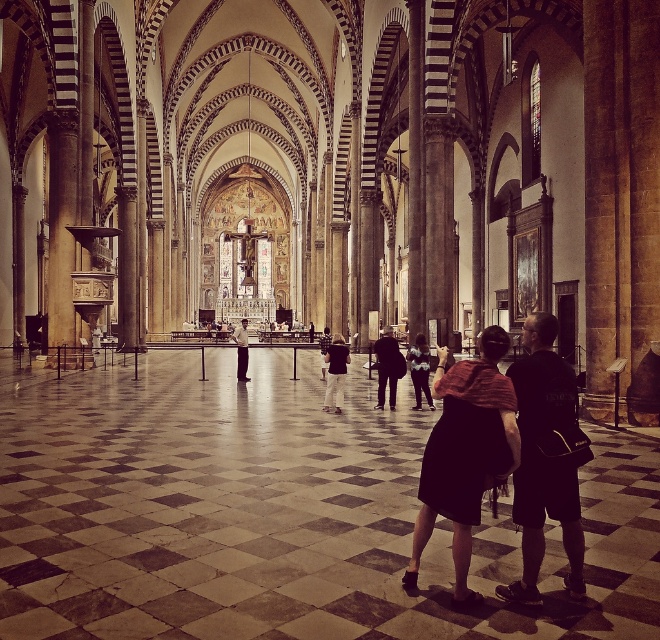
Question: Is dark gray jeans at center to the right of matte black suit at center from the viewer's perspective?

Choices:
 (A) no
 (B) yes

Answer: (B)

Question: Which of these objects is positioned closest to the denim jacket at center?

Choices:
 (A) black fabric backpack at lower right
 (B) matte black suit at center

Answer: (B)

Question: Can you confirm if dark brown fabric dress at center is bigger than dark gray fabric coat at center?

Choices:
 (A) no
 (B) yes

Answer: (A)

Question: Which is nearer to the dark gray jeans at center?

Choices:
 (A) dark gray fabric coat at center
 (B) black fabric backpack at lower right
 (C) matte black suit at center
 (D) denim jacket at center

Answer: (A)

Question: Estimate the real-world distances between objects in this image. Which object is closer to the matte black suit at center?

Choices:
 (A) dark brown fabric dress at center
 (B) dark gray fabric coat at center

Answer: (B)

Question: Does dark brown fabric dress at center appear over denim jacket at center?

Choices:
 (A) no
 (B) yes

Answer: (A)